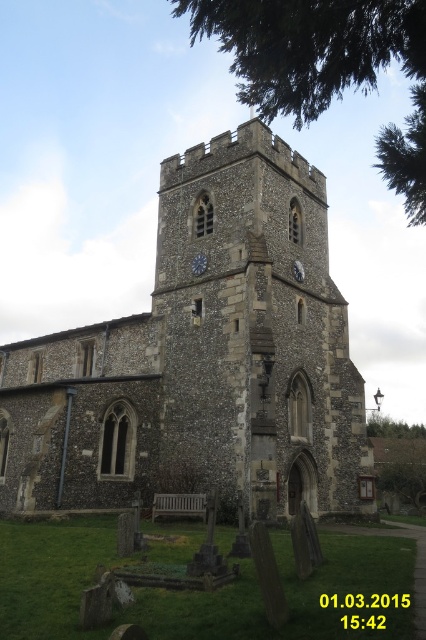
Question: Does green leafy tree at upper center lie behind green leafy tree at right?

Choices:
 (A) yes
 (B) no

Answer: (B)

Question: Which object is positioned farthest from the blue metallic clock at center?

Choices:
 (A) green leafy tree at upper center
 (B) stone church at center

Answer: (A)

Question: Can you confirm if stone church at center is bigger than green leafy tree at right?

Choices:
 (A) yes
 (B) no

Answer: (A)

Question: Is stone church at center bigger than blue metallic clock at center?

Choices:
 (A) no
 (B) yes

Answer: (B)

Question: Which object is the closest to the stone church at center?

Choices:
 (A) green leafy tree at upper center
 (B) green leafy tree at right
 (C) blue metallic clock at center

Answer: (C)

Question: Which is farther from the stone church at center?

Choices:
 (A) blue metallic clock at center
 (B) green leafy tree at upper center
 (C) green leafy tree at right

Answer: (C)